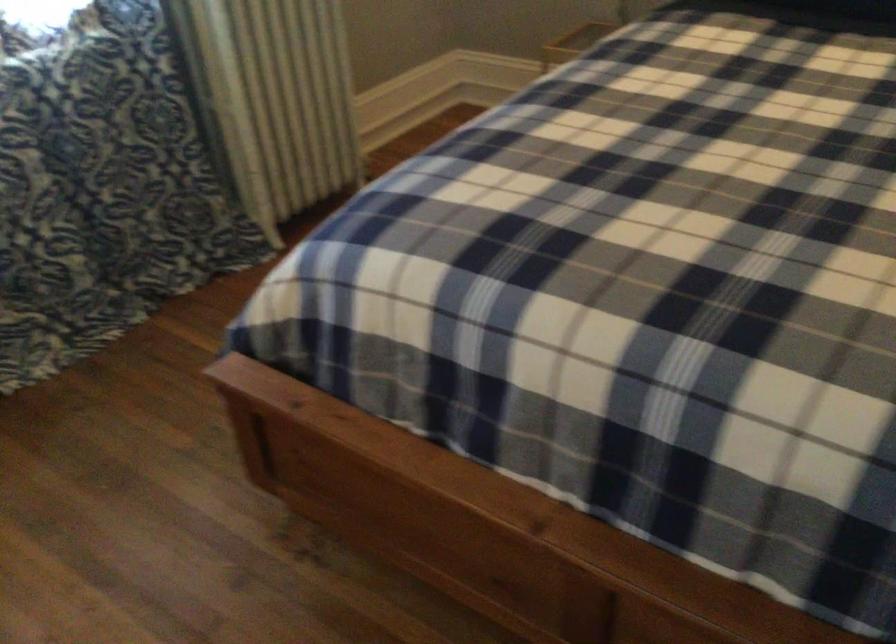
Where would you sit the bed sitting surface? Please return your answer as a coordinate pair (x, y).

(633, 279)